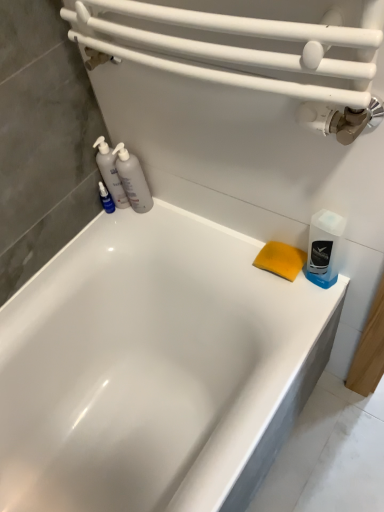
Question: Does translucent plastic bottles at left, the second cleaning product in the right-to-left sequence, come in front of translucent plastic bottles at left, placed as the 1th cleaning product when sorted from left to right?

Choices:
 (A) no
 (B) yes

Answer: (B)

Question: From a real-world perspective, does translucent plastic bottles at left, marked as the second cleaning product in a left-to-right arrangement, stand above translucent plastic bottles at left, which ranks as the third cleaning product in right-to-left order?

Choices:
 (A) no
 (B) yes

Answer: (B)

Question: Does translucent plastic bottles at left, the second cleaning product in the right-to-left sequence, have a greater width compared to translucent plastic bottles at left, which ranks as the third cleaning product in right-to-left order?

Choices:
 (A) yes
 (B) no

Answer: (B)

Question: Is translucent plastic bottles at left, the second cleaning product in the right-to-left sequence, positioned behind translucent plastic bottles at left, placed as the 1th cleaning product when sorted from left to right?

Choices:
 (A) no
 (B) yes

Answer: (A)

Question: Is translucent plastic bottles at left, marked as the second cleaning product in a left-to-right arrangement, located outside translucent plastic bottles at left, placed as the 1th cleaning product when sorted from left to right?

Choices:
 (A) no
 (B) yes

Answer: (B)

Question: Considering the positions of translucent plastic bottles at left, marked as the second cleaning product in a left-to-right arrangement, and blue translucent bottle at right, which is the first cleaning product in right-to-left order, in the image, is translucent plastic bottles at left, marked as the second cleaning product in a left-to-right arrangement, wider or thinner than blue translucent bottle at right, which is the first cleaning product in right-to-left order,?

Choices:
 (A) wide
 (B) thin

Answer: (A)

Question: Is translucent plastic bottles at left, marked as the second cleaning product in a left-to-right arrangement, taller or shorter than blue translucent bottle at right, which is the first cleaning product in right-to-left order?

Choices:
 (A) tall
 (B) short

Answer: (A)

Question: Relative to blue translucent bottle at right, which is the first cleaning product in right-to-left order, is translucent plastic bottles at left, the second cleaning product in the right-to-left sequence, in front or behind?

Choices:
 (A) behind
 (B) front

Answer: (A)

Question: From a real-world perspective, relative to blue translucent bottle at right, which is counted as the third cleaning product, starting from the left, is translucent plastic bottles at left, marked as the second cleaning product in a left-to-right arrangement, vertically above or below?

Choices:
 (A) below
 (B) above

Answer: (B)

Question: From a real-world perspective, is white glossy bathtub at center physically located above or below translucent plastic bottles at left, placed as the 1th cleaning product when sorted from left to right?

Choices:
 (A) below
 (B) above

Answer: (A)

Question: Is white glossy bathtub at center wider or thinner than translucent plastic bottles at left, placed as the 1th cleaning product when sorted from left to right?

Choices:
 (A) thin
 (B) wide

Answer: (B)

Question: Considering the positions of point (268, 370) and point (109, 159), is point (268, 370) closer or farther from the camera than point (109, 159)?

Choices:
 (A) closer
 (B) farther

Answer: (A)

Question: From their relative heights in the image, would you say white glossy bathtub at center is taller or shorter than translucent plastic bottles at left, which ranks as the third cleaning product in right-to-left order?

Choices:
 (A) short
 (B) tall

Answer: (B)

Question: From a real-world perspective, is blue translucent bottle at right, which is the first cleaning product in right-to-left order, positioned above or below white glossy bathtub at center?

Choices:
 (A) above
 (B) below

Answer: (A)

Question: Looking at their shapes, would you say blue translucent bottle at right, which is the first cleaning product in right-to-left order, is wider or thinner than white glossy bathtub at center?

Choices:
 (A) wide
 (B) thin

Answer: (B)